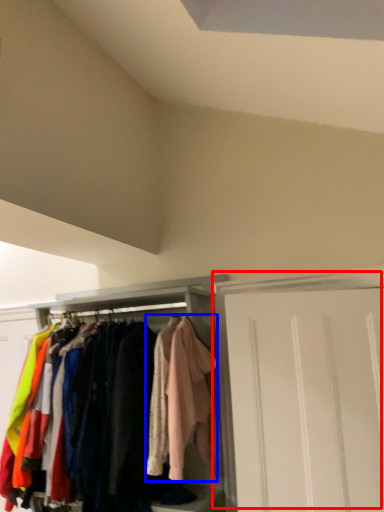
Question: Which object is further to the camera taking this photo, door (highlighted by a red box) or clothing (highlighted by a blue box)?

Choices:
 (A) door
 (B) clothing

Answer: (B)